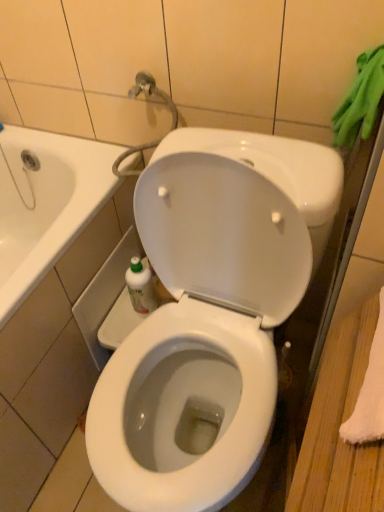
Question: Is translucent plastic bottle at lower left facing towards green rubber gloves at upper right?

Choices:
 (A) yes
 (B) no

Answer: (B)

Question: Is translucent plastic bottle at lower left facing away from green rubber gloves at upper right?

Choices:
 (A) yes
 (B) no

Answer: (B)

Question: Is translucent plastic bottle at lower left not within green rubber gloves at upper right?

Choices:
 (A) yes
 (B) no

Answer: (A)

Question: Is translucent plastic bottle at lower left with green rubber gloves at upper right?

Choices:
 (A) yes
 (B) no

Answer: (B)

Question: Does translucent plastic bottle at lower left have a smaller size compared to green rubber gloves at upper right?

Choices:
 (A) yes
 (B) no

Answer: (A)

Question: Based on their positions, is green rubber gloves at upper right located to the left or right of white glossy toilet at center?

Choices:
 (A) right
 (B) left

Answer: (A)

Question: Based on their sizes in the image, would you say green rubber gloves at upper right is bigger or smaller than white glossy toilet at center?

Choices:
 (A) small
 (B) big

Answer: (A)

Question: Do you think green rubber gloves at upper right is within white glossy toilet at center, or outside of it?

Choices:
 (A) outside
 (B) inside

Answer: (A)

Question: Considering the positions of green rubber gloves at upper right and white glossy toilet at center in the image, is green rubber gloves at upper right wider or thinner than white glossy toilet at center?

Choices:
 (A) wide
 (B) thin

Answer: (B)

Question: Is green rubber gloves at upper right taller or shorter than translucent plastic bottle at lower left?

Choices:
 (A) short
 (B) tall

Answer: (B)

Question: In terms of size, does green rubber gloves at upper right appear bigger or smaller than translucent plastic bottle at lower left?

Choices:
 (A) small
 (B) big

Answer: (B)

Question: In the image, is green rubber gloves at upper right on the left side or the right side of translucent plastic bottle at lower left?

Choices:
 (A) right
 (B) left

Answer: (A)

Question: From a real-world perspective, is green rubber gloves at upper right physically located above or below translucent plastic bottle at lower left?

Choices:
 (A) below
 (B) above

Answer: (B)

Question: Looking at the image, does translucent plastic bottle at lower left seem bigger or smaller compared to white glossy toilet at center?

Choices:
 (A) big
 (B) small

Answer: (B)

Question: From a real-world perspective, is translucent plastic bottle at lower left above or below white glossy toilet at center?

Choices:
 (A) above
 (B) below

Answer: (B)